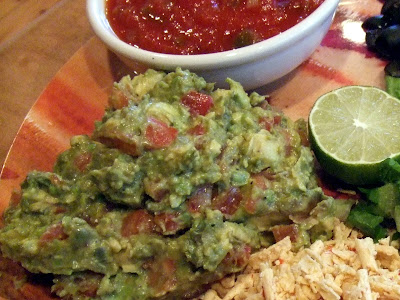
Identify the location of plate. This screenshot has height=300, width=400. (89, 57), (62, 90), (28, 146), (80, 113), (350, 22), (344, 55), (293, 88), (372, 71), (366, 4).